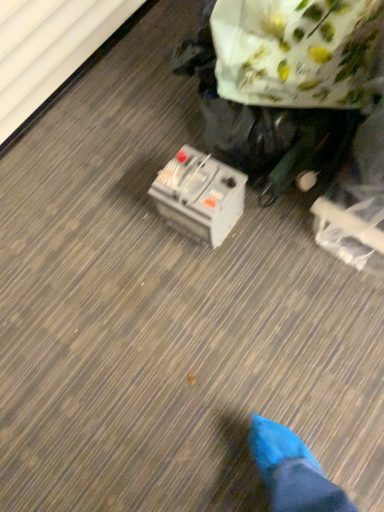
Where is `space that is in front of gray plastic battery at center`? The image size is (384, 512). space that is in front of gray plastic battery at center is located at coordinates (216, 265).